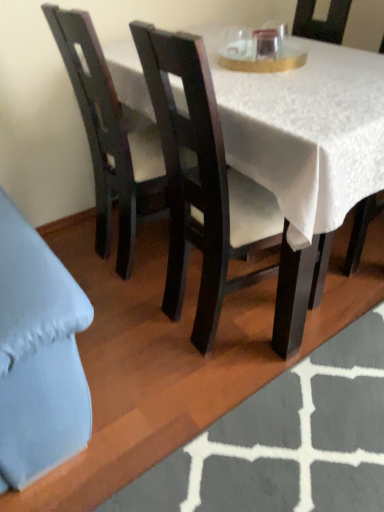
At what (x,y) coordinates should I click in order to perform the action: click on free space in front of matte dark wood chair at center, which is the 2th chair in right-to-left order. Please return your answer as a coordinate pair (x, y). This screenshot has height=512, width=384. Looking at the image, I should click on point(241,418).